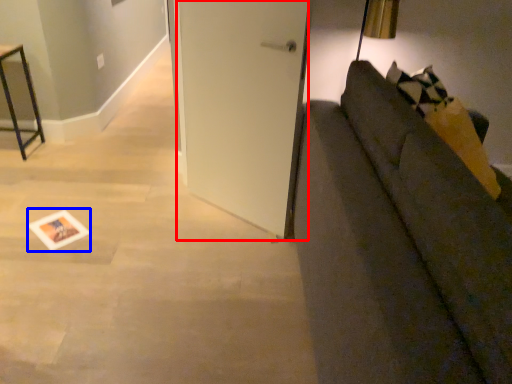
Question: Which object appears closest to the camera in this image, door (highlighted by a red box) or postcard (highlighted by a blue box)?

Choices:
 (A) door
 (B) postcard

Answer: (A)